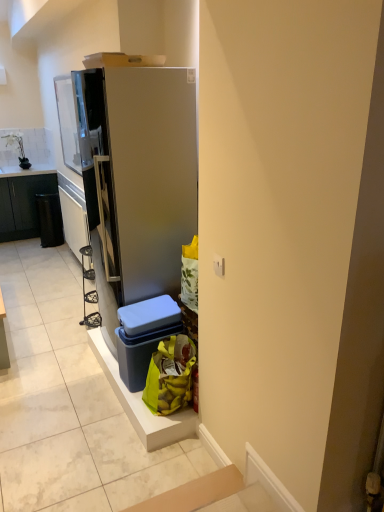
Question: In terms of width, does black matte trash can at left look wider or thinner when compared to satin silver refrigerator at center?

Choices:
 (A) thin
 (B) wide

Answer: (B)

Question: Is black matte trash can at left inside or outside of satin silver refrigerator at center?

Choices:
 (A) outside
 (B) inside

Answer: (A)

Question: Which is nearer to the yellow plastic bag at lower right?

Choices:
 (A) blue plastic storage box at lower center
 (B) metallic silver shelf at left
 (C) satin silver refrigerator at center
 (D) black matte trash can at left
 (E) black plastic recycling bin at left

Answer: (A)

Question: Estimate the real-world distances between objects in this image. Which object is closer to the metallic silver shelf at left?

Choices:
 (A) black plastic recycling bin at left
 (B) yellow plastic bag at lower right
 (C) black matte trash can at left
 (D) blue plastic storage box at lower center
 (E) satin silver refrigerator at center

Answer: (A)